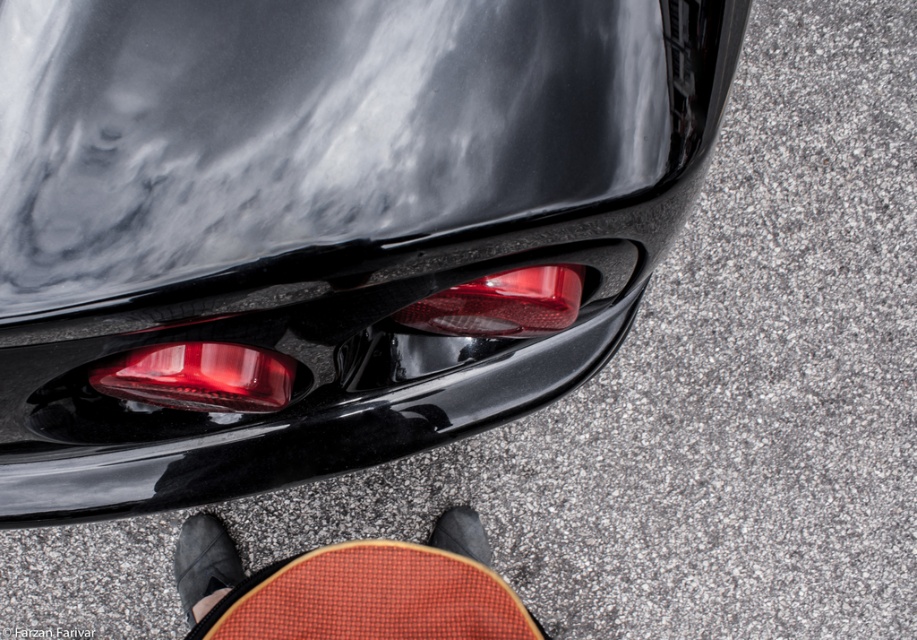
You are standing 1 meter away from the car and want to reach the point at coordinates point (384, 625). Can you reach it without moving closer?

The distance of point (384, 625) from camera is 84.85 centimeters. Since you are 1 meter away, you can reach it without moving closer.

Looking at this image, you are standing next to a black car and see the textured brown skateboard at lower center and the black suede shoe at lower center. Which object is closer to you?

The textured brown skateboard at lower center is closer to you because it is positioned above the black suede shoe at lower center, indicating it is nearer in the visual plane.

You are a delivery robot with a 24 inch wide package. You need to move from the skateboard to the car. Can you fit through the space between the matte red tail light at lower left and the black leather shoe at lower center?

The distance between the matte red tail light at lower left and the black leather shoe at lower center is 29.38 inches. Since the package is 24 inches wide, it should fit as there is enough space.